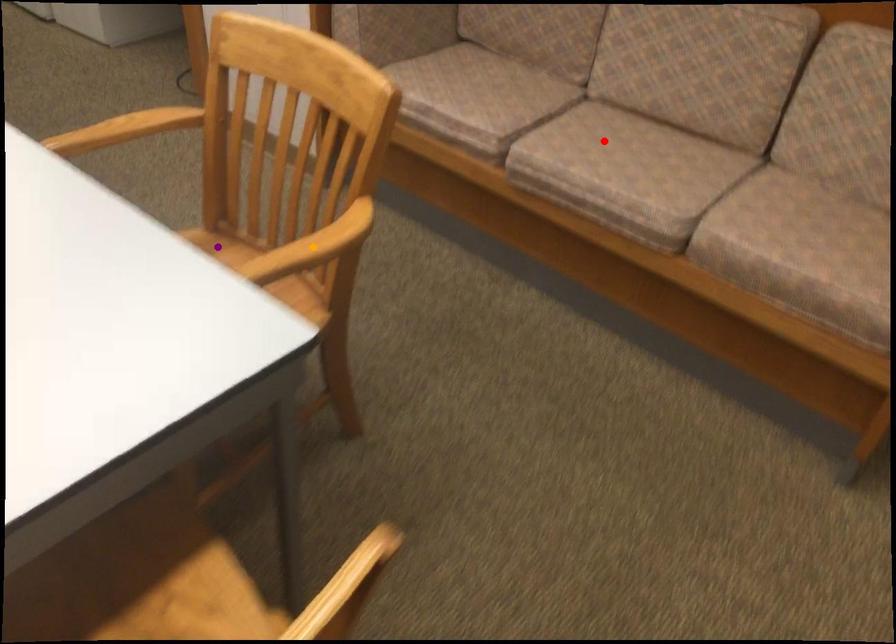
Order these from nearest to farthest:
1. red point
2. orange point
3. purple point

red point, purple point, orange point